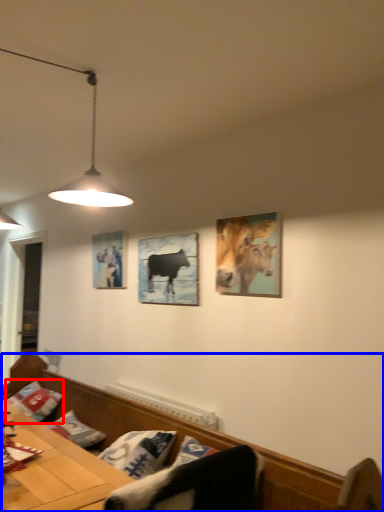
Question: Among these objects, which one is farthest to the camera, pillow (highlighted by a red box) or furniture (highlighted by a blue box)?

Choices:
 (A) pillow
 (B) furniture

Answer: (A)